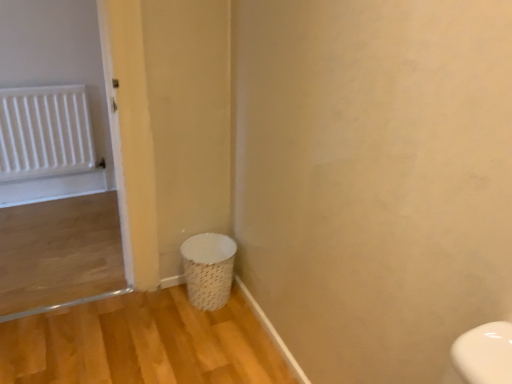
The width and height of the screenshot is (512, 384). What do you see at coordinates (44, 132) in the screenshot? I see `white plastic radiator at upper left` at bounding box center [44, 132].

Identify the location of white plastic radiator at upper left. Image resolution: width=512 pixels, height=384 pixels. (44, 132).

The height and width of the screenshot is (384, 512). What do you see at coordinates (208, 269) in the screenshot? I see `white woven laundry basket at lower left` at bounding box center [208, 269].

Identify the location of white woven laundry basket at lower left. The width and height of the screenshot is (512, 384). (208, 269).

What is the approximate height of white woven laundry basket at lower left?

It is 10.56 inches.

Where is `white plastic radiator at upper left`? The width and height of the screenshot is (512, 384). white plastic radiator at upper left is located at coordinates (44, 132).

Considering the relative positions of white woven laundry basket at lower left and white plastic radiator at upper left in the image provided, is white woven laundry basket at lower left to the left of white plastic radiator at upper left from the viewer's perspective?

In fact, white woven laundry basket at lower left is to the right of white plastic radiator at upper left.

Between white woven laundry basket at lower left and white plastic radiator at upper left, which one is positioned behind?

Positioned behind is white plastic radiator at upper left.

Is point (206, 255) closer or farther from the camera than point (74, 121)?

Point (206, 255) is positioned closer to the camera compared to point (74, 121).

From the image's perspective, relative to white plastic radiator at upper left, is white woven laundry basket at lower left above or below?

Based on their image positions, white woven laundry basket at lower left is located beneath white plastic radiator at upper left.

From a real-world perspective, relative to white plastic radiator at upper left, is white woven laundry basket at lower left vertically above or below?

In terms of real-world spatial position, white woven laundry basket at lower left is below white plastic radiator at upper left.

Considering the sizes of objects white woven laundry basket at lower left and white plastic radiator at upper left in the image provided, who is thinner, white woven laundry basket at lower left or white plastic radiator at upper left?

white plastic radiator at upper left.

Between white woven laundry basket at lower left and white plastic radiator at upper left, which one has less height?

white woven laundry basket at lower left.

In terms of size, does white woven laundry basket at lower left appear bigger or smaller than white plastic radiator at upper left?

Considering their sizes, white woven laundry basket at lower left takes up more space than white plastic radiator at upper left.

Is white woven laundry basket at lower left not within white plastic radiator at upper left?

Absolutely, white woven laundry basket at lower left is external to white plastic radiator at upper left.

Is there a large distance between white woven laundry basket at lower left and white plastic radiator at upper left?

white woven laundry basket at lower left is far away from white plastic radiator at upper left.

Is white woven laundry basket at lower left facing towards white plastic radiator at upper left?

No, white woven laundry basket at lower left is not oriented towards white plastic radiator at upper left.

What's the angular difference between white woven laundry basket at lower left and white plastic radiator at upper left's facing directions?

They differ by 0.674 degrees in their facing directions.

How much distance is there between white woven laundry basket at lower left and white plastic radiator at upper left?

They are 1.29 meters apart.

Find the location of `radiator above the white woven laundry basket at lower left (from a real-world perspective)`. radiator above the white woven laundry basket at lower left (from a real-world perspective) is located at coordinates (44, 132).

Considering the relative positions of white plastic radiator at upper left and white woven laundry basket at lower left in the image provided, is white plastic radiator at upper left to the right of white woven laundry basket at lower left from the viewer's perspective?

No, white plastic radiator at upper left is not to the right of white woven laundry basket at lower left.

Based on the photo, considering the relative positions of white plastic radiator at upper left and white woven laundry basket at lower left in the image provided, is white plastic radiator at upper left in front of white woven laundry basket at lower left?

No, it is not.

Is point (15, 89) positioned before point (224, 302)?

No, it is not.

From the image's perspective, relative to white woven laundry basket at lower left, is white plastic radiator at upper left above or below?

white plastic radiator at upper left is above white woven laundry basket at lower left.

From a real-world perspective, relative to white woven laundry basket at lower left, is white plastic radiator at upper left vertically above or below?

Clearly, from a real-world perspective, white plastic radiator at upper left is above white woven laundry basket at lower left.

Is white plastic radiator at upper left wider than white woven laundry basket at lower left?

No, white plastic radiator at upper left is not wider than white woven laundry basket at lower left.

Who is shorter, white plastic radiator at upper left or white woven laundry basket at lower left?

Standing shorter between the two is white woven laundry basket at lower left.

Who is bigger, white plastic radiator at upper left or white woven laundry basket at lower left?

white woven laundry basket at lower left is bigger.

Would you say white woven laundry basket at lower left is part of white plastic radiator at upper left's contents?

No, white woven laundry basket at lower left is located outside of white plastic radiator at upper left.

Is white plastic radiator at upper left next to white woven laundry basket at lower left and touching it?

No, white plastic radiator at upper left is not touching white woven laundry basket at lower left.

Is white plastic radiator at upper left positioned with its back to white woven laundry basket at lower left?

No.

How many degrees apart are the facing directions of white plastic radiator at upper left and white woven laundry basket at lower left?

0.674 degrees separate the facing orientations of white plastic radiator at upper left and white woven laundry basket at lower left.

How much distance is there between white plastic radiator at upper left and white woven laundry basket at lower left?

white plastic radiator at upper left is 1.29 meters away from white woven laundry basket at lower left.

I want to click on laundry basket in front of the white plastic radiator at upper left, so click(208, 269).

Where is `radiator above the white woven laundry basket at lower left (from a real-world perspective)`? radiator above the white woven laundry basket at lower left (from a real-world perspective) is located at coordinates (44, 132).

This screenshot has width=512, height=384. In order to click on laundry basket in front of the white plastic radiator at upper left in this screenshot , I will do `click(208, 269)`.